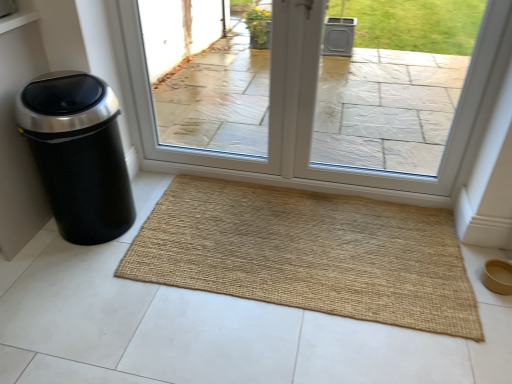
Find the location of `free point to the right of black matte trash can at left`. free point to the right of black matte trash can at left is located at coordinates (175, 224).